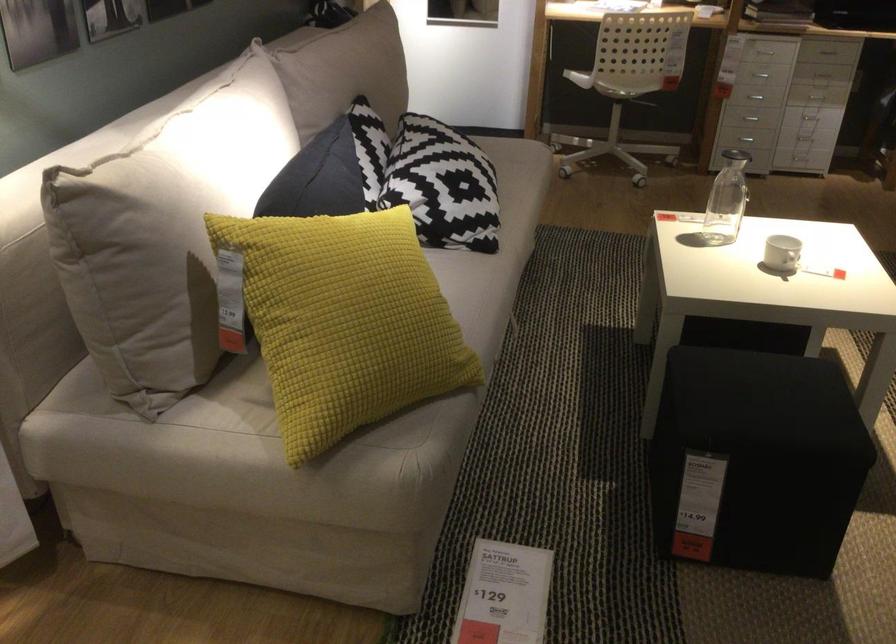
The image size is (896, 644). Find the location of `yellow textured pillow`. yellow textured pillow is located at coordinates (343, 321).